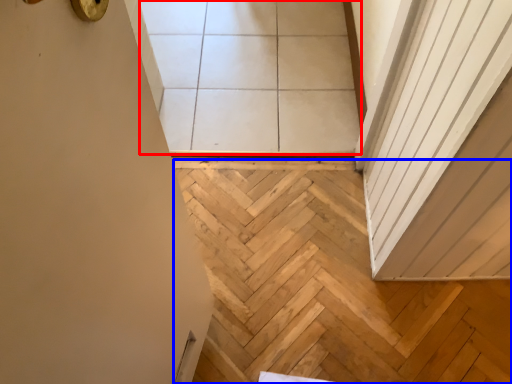
Question: Among these objects, which one is nearest to the camera, tile (highlighted by a red box) or stairwell (highlighted by a blue box)?

Choices:
 (A) tile
 (B) stairwell

Answer: (B)